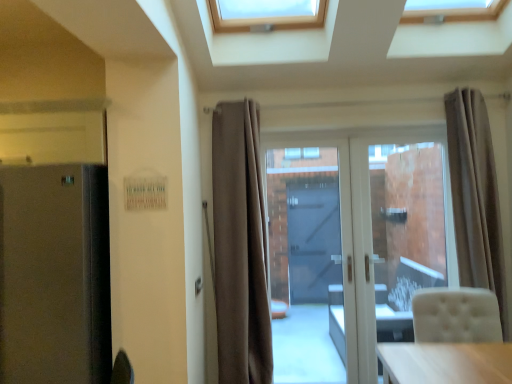
Question: Considering the relative sizes of white glossy door at center and transparent glass door at center in the image provided, is white glossy door at center thinner than transparent glass door at center?

Choices:
 (A) yes
 (B) no

Answer: (A)

Question: Considering the relative sizes of white glossy door at center and transparent glass door at center in the image provided, is white glossy door at center smaller than transparent glass door at center?

Choices:
 (A) no
 (B) yes

Answer: (B)

Question: From the image's perspective, would you say white glossy door at center is shown under transparent glass door at center?

Choices:
 (A) yes
 (B) no

Answer: (A)

Question: Is there a large distance between white glossy door at center and transparent glass door at center?

Choices:
 (A) no
 (B) yes

Answer: (A)

Question: Is white glossy door at center aimed at transparent glass door at center?

Choices:
 (A) no
 (B) yes

Answer: (B)

Question: Is white glossy door at center taller than transparent glass door at center?

Choices:
 (A) no
 (B) yes

Answer: (A)

Question: From a real-world perspective, does beige fabric curtain at right, which is the first curtain from right to left, stand above transparent glass door at center?

Choices:
 (A) yes
 (B) no

Answer: (A)

Question: Can you confirm if beige fabric curtain at right, which is the first curtain from right to left, is smaller than transparent glass door at center?

Choices:
 (A) no
 (B) yes

Answer: (A)

Question: Is beige fabric curtain at right, the 2th curtain in the left-to-right sequence, turned away from transparent glass door at center?

Choices:
 (A) no
 (B) yes

Answer: (A)

Question: Considering the relative sizes of beige fabric curtain at right, the 2th curtain in the left-to-right sequence, and transparent glass door at center in the image provided, is beige fabric curtain at right, the 2th curtain in the left-to-right sequence, shorter than transparent glass door at center?

Choices:
 (A) no
 (B) yes

Answer: (B)

Question: Is beige fabric curtain at right, the 2th curtain in the left-to-right sequence, bigger than transparent glass door at center?

Choices:
 (A) yes
 (B) no

Answer: (A)

Question: Is beige fabric curtain at right, which is the first curtain from right to left, wider than transparent glass door at center?

Choices:
 (A) no
 (B) yes

Answer: (B)

Question: From the image's perspective, is white glossy door at center below satin black fridge at left?

Choices:
 (A) yes
 (B) no

Answer: (B)